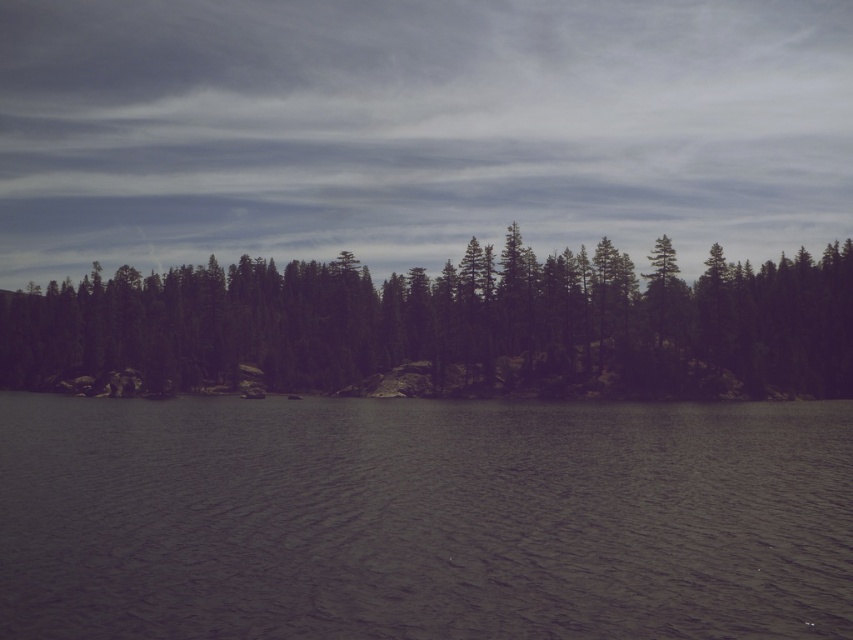
Question: Can you confirm if dark gray water at center is positioned below green matte trees at center?

Choices:
 (A) yes
 (B) no

Answer: (A)

Question: Among these points, which one is farthest from the camera?

Choices:
 (A) (341, 364)
 (B) (321, 579)

Answer: (A)

Question: Can you confirm if dark gray water at center is positioned above green matte trees at center?

Choices:
 (A) yes
 (B) no

Answer: (B)

Question: Which object appears farthest from the camera in this image?

Choices:
 (A) green matte trees at center
 (B) dark gray water at center

Answer: (A)

Question: Which point appears closest to the camera in this image?

Choices:
 (A) (457, 280)
 (B) (534, 600)

Answer: (B)

Question: Does dark gray water at center appear on the left side of green matte trees at center?

Choices:
 (A) yes
 (B) no

Answer: (B)